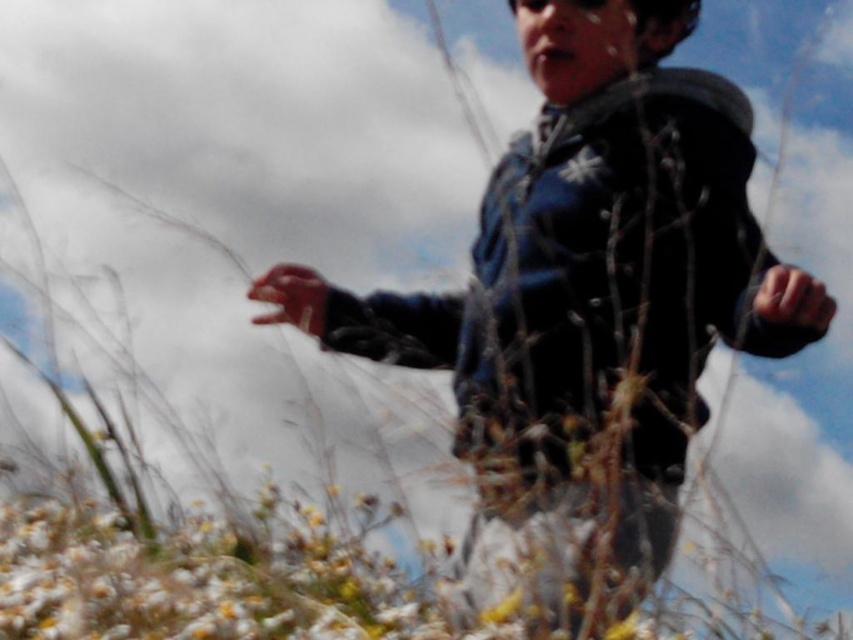
Does dark blue jacket at center have a lesser width compared to smooth skin hand at center?

In fact, dark blue jacket at center might be wider than smooth skin hand at center.

Can you confirm if dark blue jacket at center is positioned below smooth skin hand at center?

No, dark blue jacket at center is not below smooth skin hand at center.

Measure the distance between dark blue jacket at center and camera.

The distance of dark blue jacket at center from camera is 2.93 meters.

You are a GUI agent. You are given a task and a screenshot of the screen. Output one action in this format:
    pyautogui.click(x=<x>, y=<y>)
    Task: Click on the dark blue jacket at center
    
    Given the screenshot: What is the action you would take?
    pyautogui.click(x=604, y=257)